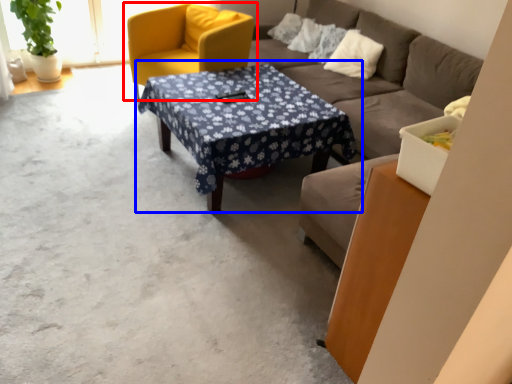
Question: Which object is further to the camera taking this photo, chair (highlighted by a red box) or coffee table (highlighted by a blue box)?

Choices:
 (A) chair
 (B) coffee table

Answer: (A)